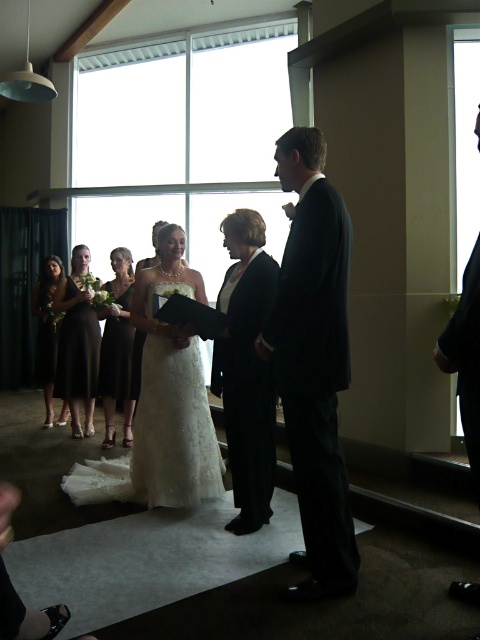
Question: Is black suit at right above matte black dress at left?

Choices:
 (A) yes
 (B) no

Answer: (B)

Question: Is black suit at right behind dark brown satin dress at left?

Choices:
 (A) yes
 (B) no

Answer: (B)

Question: Is dark brown satin dress at left above dark brown satin dress at center?

Choices:
 (A) yes
 (B) no

Answer: (A)

Question: Based on their relative distances, which object is nearer to the black suit at right?

Choices:
 (A) white satin dress at center
 (B) matte black dress at left
 (C) black satin suit at center

Answer: (C)

Question: Which object is closer to the camera taking this photo?

Choices:
 (A) matte black dress at left
 (B) dark brown satin dress at center

Answer: (B)

Question: Which point appears closest to the camera in this image?

Choices:
 (A) (192, 358)
 (B) (111, 410)
 (C) (70, 353)
 (D) (44, 352)

Answer: (A)